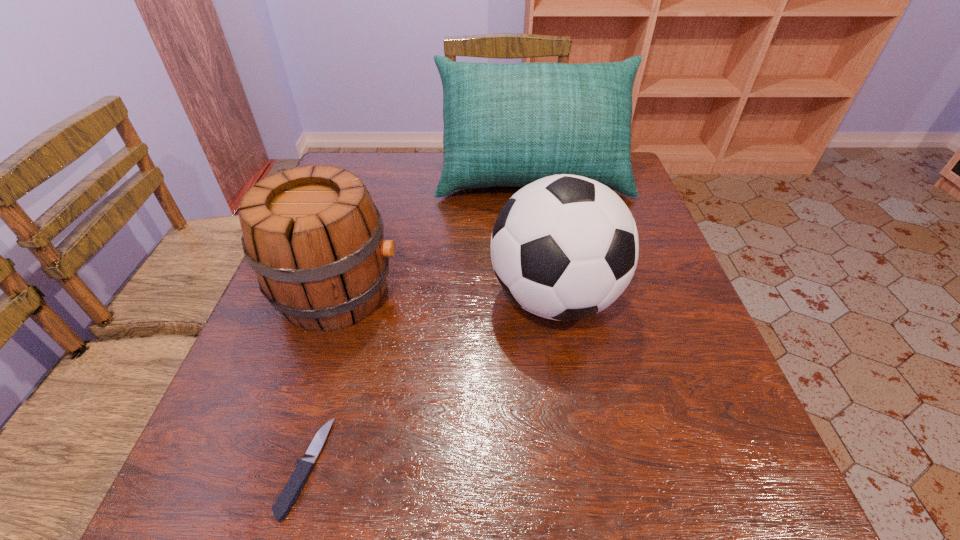
This screenshot has height=540, width=960. In order to click on free space that satisfies the following two spatial constraints: 1. on the front-facing side of the farthest object; 2. on the side of the cider where the spigot is located in this screenshot , I will do `click(551, 293)`.

The height and width of the screenshot is (540, 960). I want to click on free region that satisfies the following two spatial constraints: 1. on the front-facing side of the farthest object; 2. on the side of the cider where the spigot is located, so click(x=551, y=293).

You are a GUI agent. You are given a task and a screenshot of the screen. Output one action in this format:
    pyautogui.click(x=<x>, y=<y>)
    Task: Click on the free space that satisfies the following two spatial constraints: 1. on the front-facing side of the cushion; 2. on the side of the cider where the spigot is located
    This screenshot has width=960, height=540.
    Given the screenshot: What is the action you would take?
    pyautogui.click(x=551, y=293)